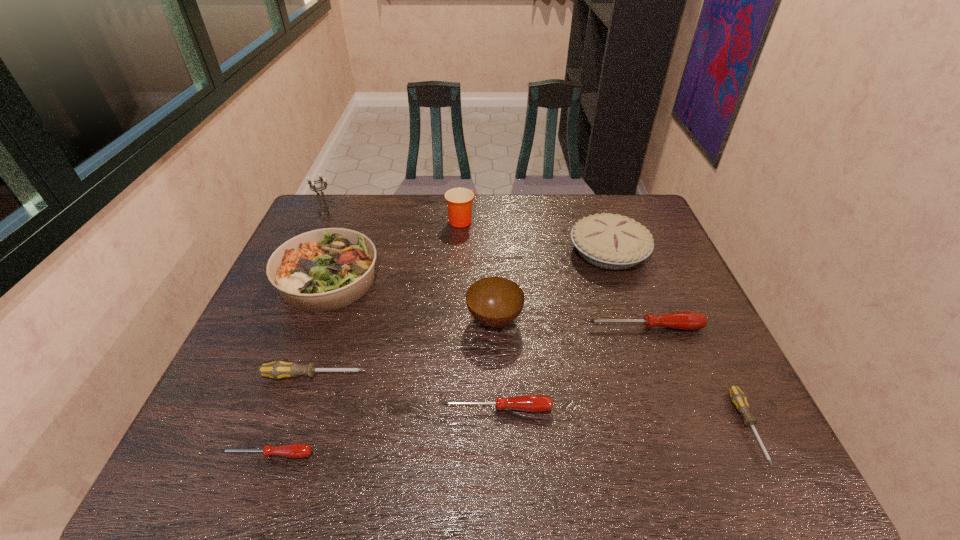
Where is `free space located 0.290m on the back of the farthest red screwdriver`? free space located 0.290m on the back of the farthest red screwdriver is located at coordinates (616, 251).

Where is `vacant space located at the tip of the farther gray screwdriver`? Image resolution: width=960 pixels, height=540 pixels. vacant space located at the tip of the farther gray screwdriver is located at coordinates (531, 376).

Identify the location of free space located 0.120m on the left of the second red screwdriver from left to right. The height and width of the screenshot is (540, 960). [386, 408].

The width and height of the screenshot is (960, 540). I want to click on free space located on the right of the smallest red screwdriver, so tap(428, 454).

Image resolution: width=960 pixels, height=540 pixels. I want to click on candle holder that is at the far edge, so click(x=323, y=208).

This screenshot has height=540, width=960. I want to click on cup that is at the far edge, so click(x=459, y=200).

This screenshot has height=540, width=960. I want to click on pie present at the far edge, so click(x=614, y=242).

I want to click on candle holder that is at the left edge, so click(x=323, y=208).

Identify the location of salad plate present at the left edge. This screenshot has height=540, width=960. (322, 270).

Where is `pie present at the right edge`? This screenshot has height=540, width=960. pie present at the right edge is located at coordinates (614, 242).